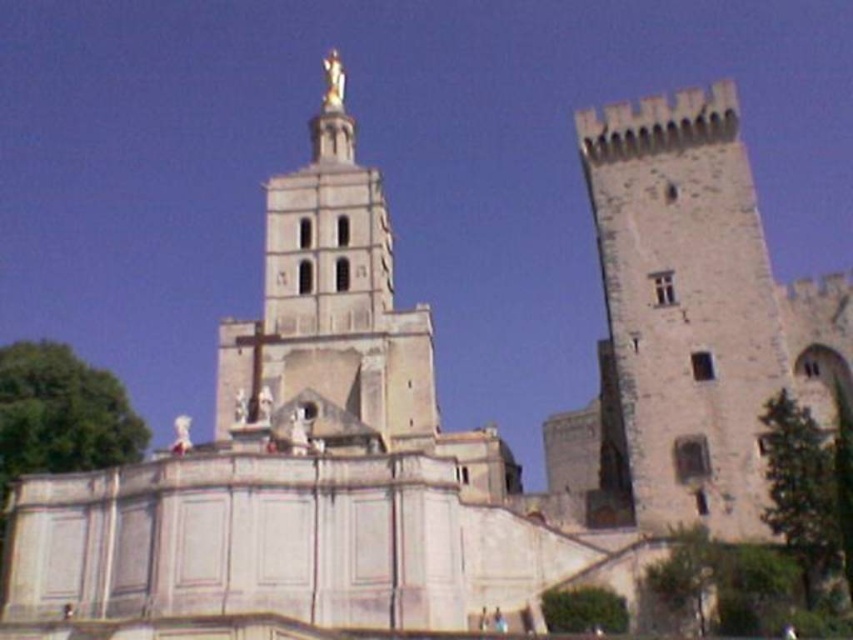
Does point (599, 180) lie in front of point (184, 449)?

No, it is not.

Describe the element at coordinates (699, 308) in the screenshot. I see `stone medieval tower at right` at that location.

The width and height of the screenshot is (853, 640). Describe the element at coordinates (699, 308) in the screenshot. I see `stone medieval tower at right` at that location.

The width and height of the screenshot is (853, 640). In order to click on stone medieval tower at right in this screenshot , I will do `click(699, 308)`.